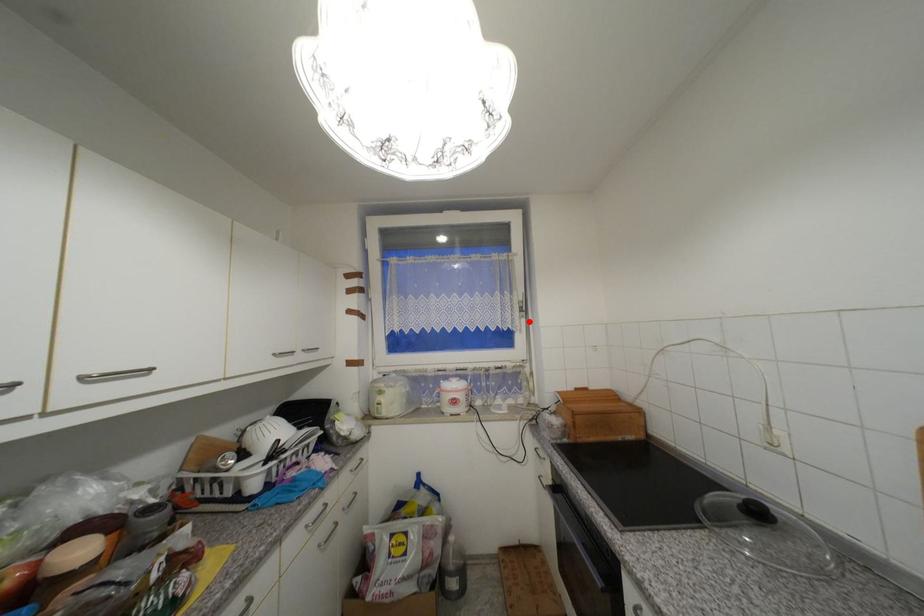
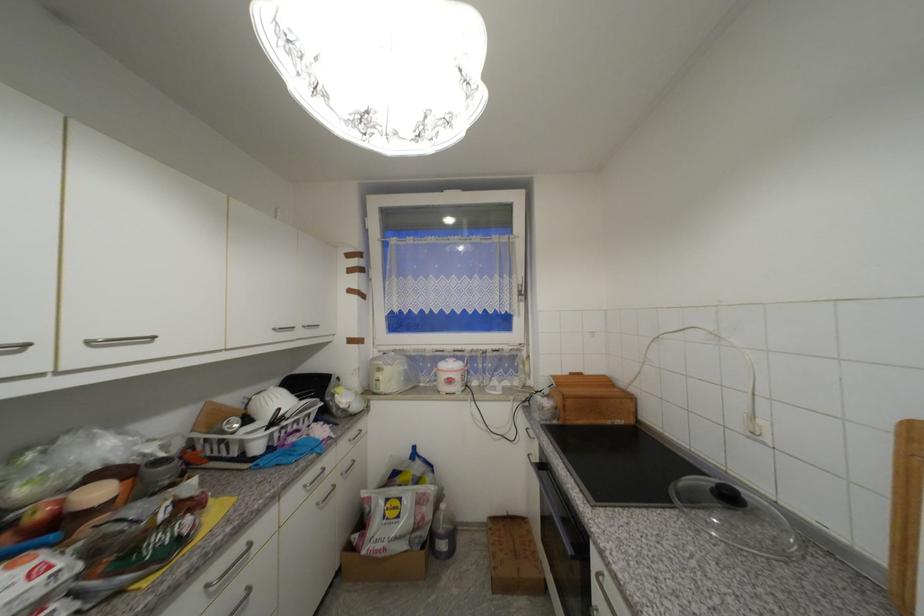
Locate, in the second image, the point that corresponds to the highlighted location in the first image.

(528, 306)